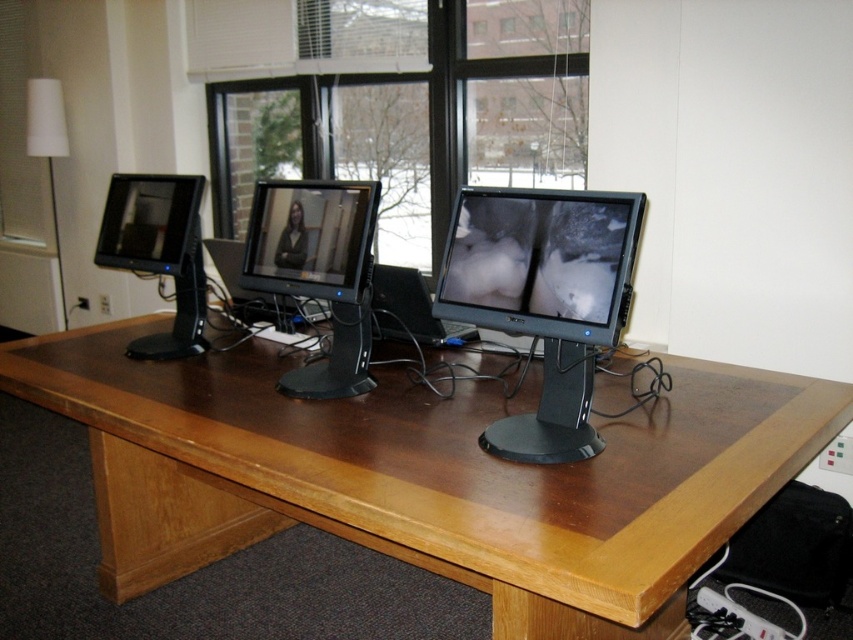
You are organizing a presentation and need to place a large poster on the desk. The poster is as wide as the transparent glass window at center. Will it fit between the black glossy monitor at center and the edge of the desk?

The transparent glass window at center is wider than the black glossy monitor at center. However, since the poster is as wide as the window, it may not fit between the monitor and the desk edge unless there is enough space. The description only compares their widths, not their positions on the desk. More information about the desk layout is needed to determine if there is sufficient space.

You are organizing a presentation and need to adjust the distance between the transparent glass window at center and the matte black monitor at center to ensure proper lighting. The ideal distance for optimal visibility is 5 feet. Is the current distance sufficient?

The transparent glass window at center and matte black monitor at center are 5.42 feet apart, which exceeds the ideal distance of 5 feet. Therefore, the current distance is sufficient for optimal visibility.